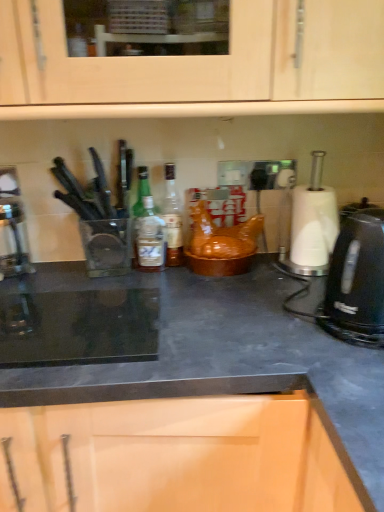
The image size is (384, 512). I want to click on free space to the left of translucent glass bottle at center, so click(x=107, y=271).